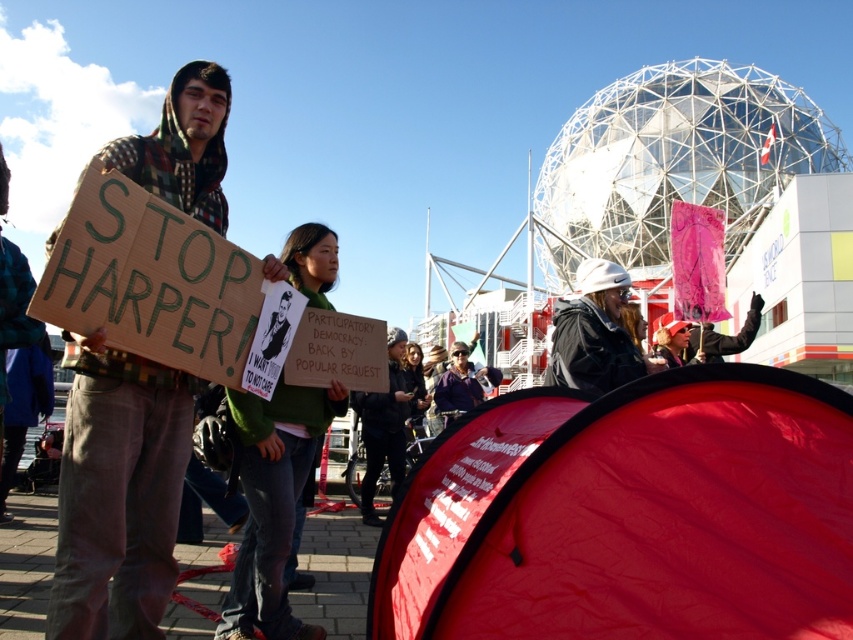
Question: Which of the following is the farthest from the observer?

Choices:
 (A) [585, 390]
 (B) [65, 563]
 (C) [299, 237]

Answer: (C)

Question: Does plaid fabric hoodie at left come in front of green fabric shirt at center?

Choices:
 (A) no
 (B) yes

Answer: (B)

Question: Based on their relative distances, which object is farther from the green fabric shirt at center?

Choices:
 (A) white matte helmet at upper center
 (B) red fabric tent at lower right
 (C) plaid fabric hoodie at left

Answer: (A)

Question: Is red fabric tent at lower right to the right of plaid fabric hoodie at left from the viewer's perspective?

Choices:
 (A) yes
 (B) no

Answer: (A)

Question: Based on their relative distances, which object is farther from the white matte helmet at upper center?

Choices:
 (A) green fabric shirt at center
 (B) red fabric tent at lower right

Answer: (A)

Question: Is plaid fabric hoodie at left positioned behind white matte helmet at upper center?

Choices:
 (A) no
 (B) yes

Answer: (A)